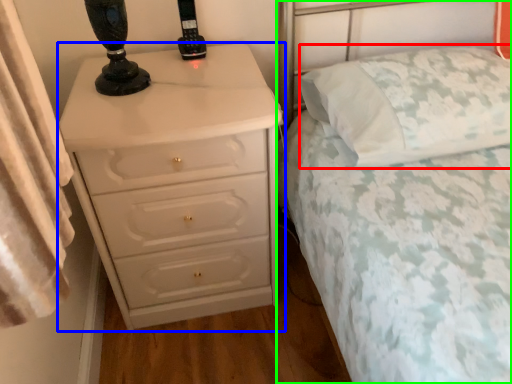
Question: Based on their relative distances, which object is nearer to pillow (highlighted by a red box)? Choose from chest of drawers (highlighted by a blue box) and bed (highlighted by a green box).

Choices:
 (A) chest of drawers
 (B) bed

Answer: (B)